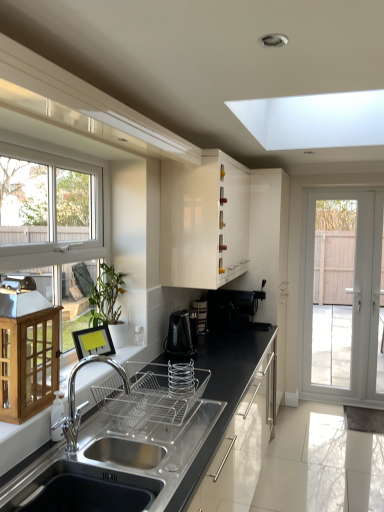
Question: Is white glossy screen door at right to the right of satin black countertop at lower center from the viewer's perspective?

Choices:
 (A) yes
 (B) no

Answer: (A)

Question: Can you confirm if white glossy screen door at right is taller than satin black countertop at lower center?

Choices:
 (A) no
 (B) yes

Answer: (B)

Question: Is white glossy screen door at right further to the viewer compared to satin black countertop at lower center?

Choices:
 (A) yes
 (B) no

Answer: (A)

Question: Does white glossy screen door at right have a larger size compared to satin black countertop at lower center?

Choices:
 (A) yes
 (B) no

Answer: (A)

Question: From a real-world perspective, is white glossy screen door at right over satin black countertop at lower center?

Choices:
 (A) no
 (B) yes

Answer: (B)

Question: From the image's perspective, relative to black plastic coffee maker at upper right, positioned as the 4th appliance in front-to-back order, is white glossy screen door at right above or below?

Choices:
 (A) above
 (B) below

Answer: (B)

Question: In terms of height, does white glossy screen door at right look taller or shorter compared to black plastic coffee maker at upper right, which appears as the 1th appliance when viewed from the back?

Choices:
 (A) tall
 (B) short

Answer: (A)

Question: Is white glossy screen door at right inside the boundaries of black plastic coffee maker at upper right, positioned as the 4th appliance in front-to-back order, or outside?

Choices:
 (A) outside
 (B) inside

Answer: (A)

Question: In the image, is white glossy screen door at right positioned in front of or behind black plastic coffee maker at upper right, which appears as the 1th appliance when viewed from the back?

Choices:
 (A) front
 (B) behind

Answer: (B)

Question: From a real-world perspective, is green matte plant at upper left positioned above or below satin black countertop at lower center?

Choices:
 (A) above
 (B) below

Answer: (A)

Question: Do you think green matte plant at upper left is within satin black countertop at lower center, or outside of it?

Choices:
 (A) inside
 (B) outside

Answer: (B)

Question: In terms of width, does green matte plant at upper left look wider or thinner when compared to satin black countertop at lower center?

Choices:
 (A) wide
 (B) thin

Answer: (B)

Question: Is green matte plant at upper left taller or shorter than satin black countertop at lower center?

Choices:
 (A) tall
 (B) short

Answer: (A)

Question: Based on their sizes in the image, would you say white glossy cabinet at upper center, the second cabinetry when ordered from left to right, is bigger or smaller than satin black kettle at center, which is the 2th appliance from back to front?

Choices:
 (A) big
 (B) small

Answer: (A)

Question: From the image's perspective, is white glossy cabinet at upper center, the 1th cabinetry when ordered from back to front, located above or below satin black kettle at center, which is the 2th appliance from back to front?

Choices:
 (A) below
 (B) above

Answer: (B)